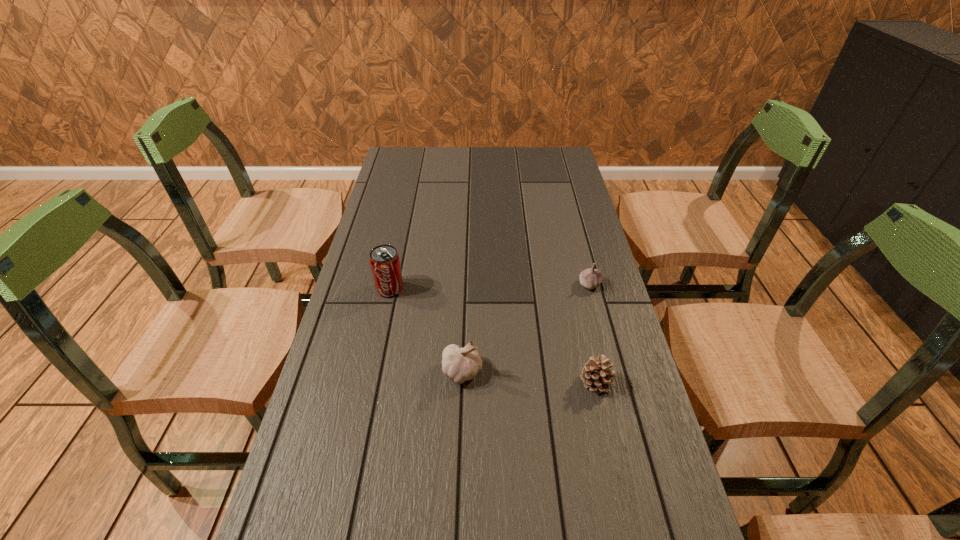
Where is `free space that satisfies the following two spatial constraints: 1. on the front side of the second object from left to right; 2. on the left side of the pinecone`? This screenshot has width=960, height=540. free space that satisfies the following two spatial constraints: 1. on the front side of the second object from left to right; 2. on the left side of the pinecone is located at coordinates (462, 383).

I want to click on vacant space that satisfies the following two spatial constraints: 1. on the front side of the pop soda; 2. on the left side of the nearer garlic, so click(x=372, y=372).